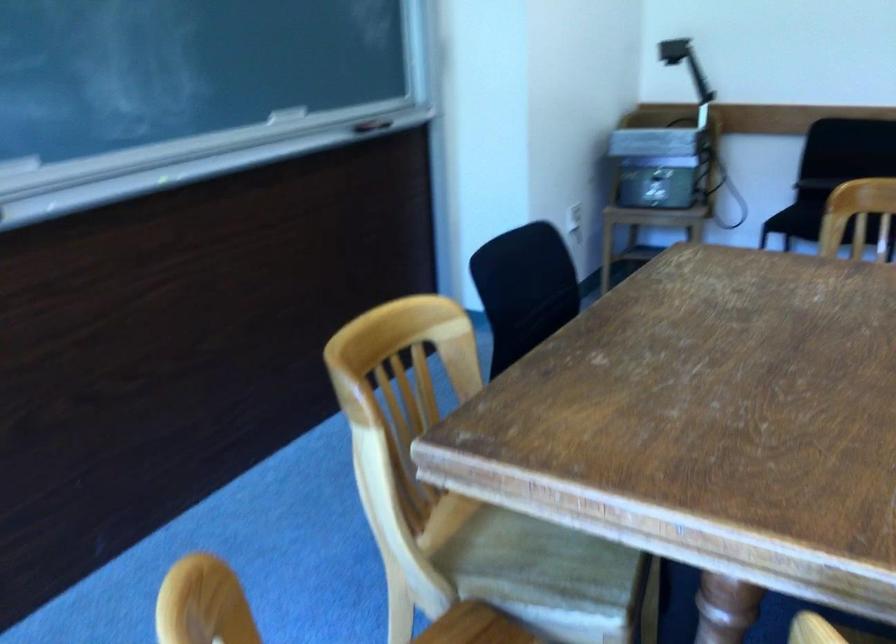
Image resolution: width=896 pixels, height=644 pixels. Identify the location of chair sitting surface. (528, 556).